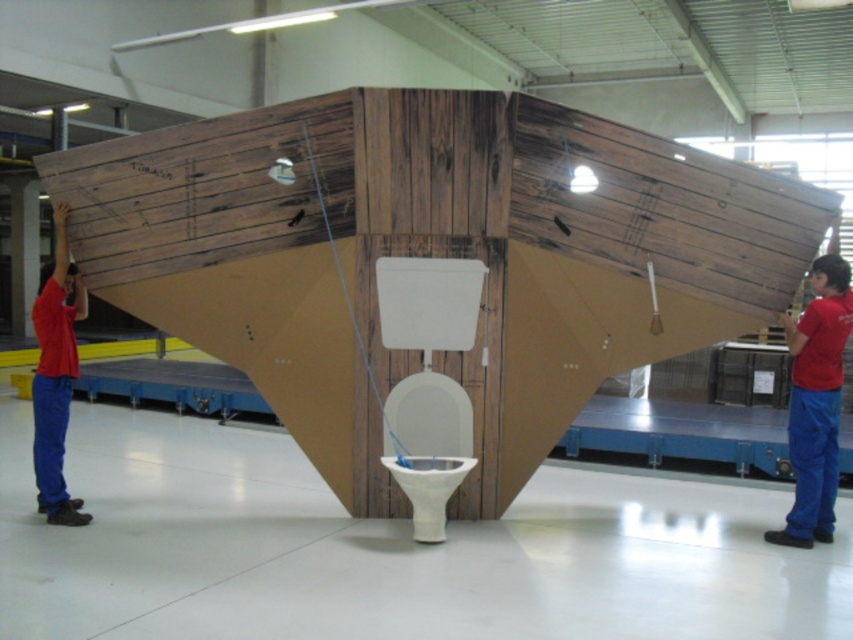
Question: Is red cotton shirt at center smaller than matte red shirt at left?

Choices:
 (A) yes
 (B) no

Answer: (A)

Question: Which of the following is the closest to the observer?

Choices:
 (A) red cotton shirt at center
 (B) matte red shirt at left

Answer: (B)

Question: Can you confirm if red cotton shirt at center is positioned to the right of matte red shirt at left?

Choices:
 (A) yes
 (B) no

Answer: (A)

Question: Which of the following is the closest to the observer?

Choices:
 (A) matte red shirt at left
 (B) red cotton shirt at center

Answer: (A)

Question: Does red cotton shirt at center appear on the right side of matte red shirt at left?

Choices:
 (A) no
 (B) yes

Answer: (B)